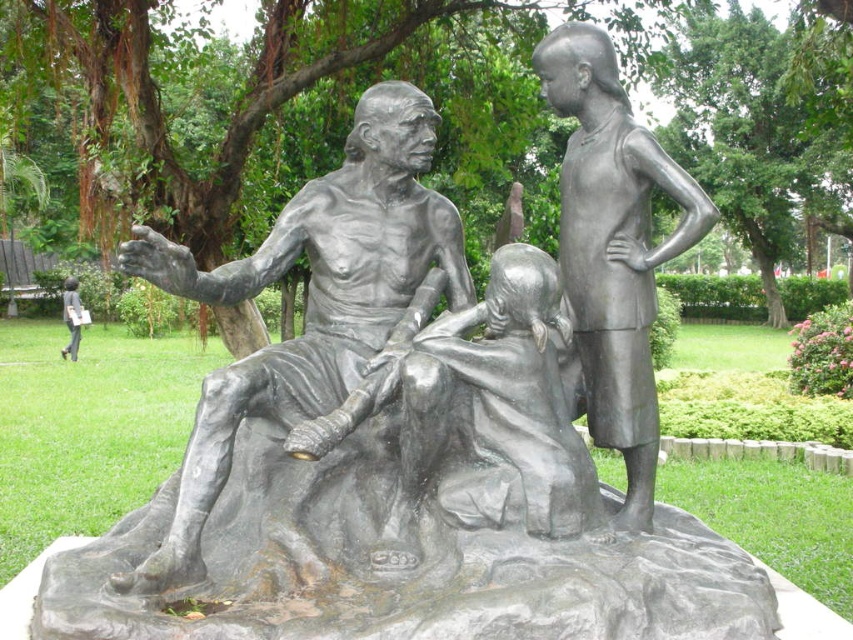
Question: Is bronze statue of child at center above matte black statue at lower left?

Choices:
 (A) yes
 (B) no

Answer: (B)

Question: Which point is closer to the camera?

Choices:
 (A) bronze statue of man at center
 (B) bronze statue of child at center

Answer: (A)

Question: From the image, what is the correct spatial relationship of bronze statue of child at center in relation to matte black statue at lower left?

Choices:
 (A) right
 (B) left

Answer: (A)

Question: Does bronze statue of man at center have a smaller size compared to bronze statue of child at center?

Choices:
 (A) no
 (B) yes

Answer: (A)

Question: Estimate the real-world distances between objects in this image. Which object is farther from the bronze statue of child at center?

Choices:
 (A) matte black statue at lower left
 (B) bronze statue of man at center

Answer: (A)

Question: Which point is closer to the camera?

Choices:
 (A) (599, 422)
 (B) (65, 355)

Answer: (A)